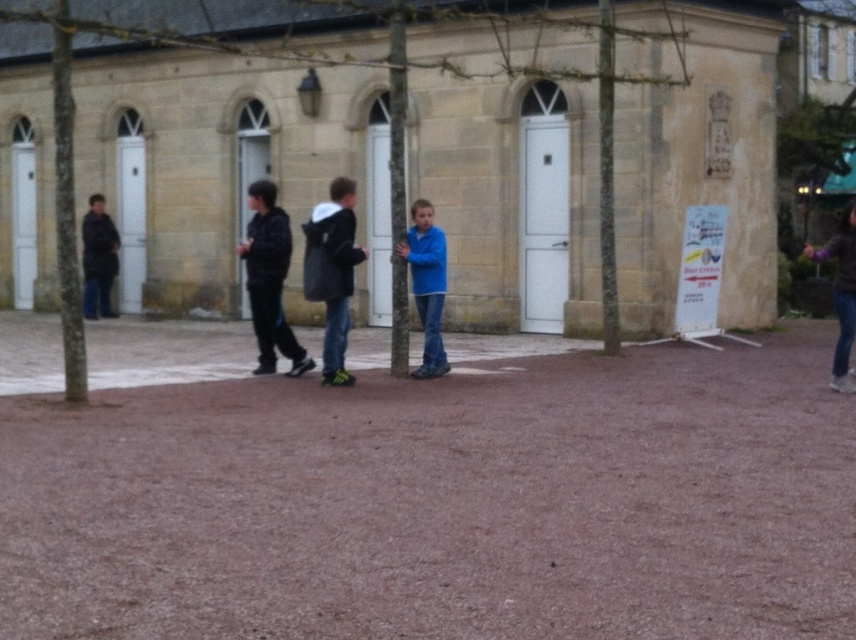
Consider the image. You are a delivery person needing to place a package between the smooth bark tree at center and the dark brown leather jacket at left. The package requires 2 meters of space. Is there enough space between them?

The smooth bark tree at center and dark brown leather jacket at left are 3.60 meters apart, so yes, there is enough space between them to place the package as the distance is greater than 2 meters.

You are standing in the courtyard and want to see the entrance of the stone building. The smooth bark tree at center and the blue matte jacket at center are blocking your view. Which object is closer to you, making it the main obstruction?

The smooth bark tree at center is located above the blue matte jacket at center, so the blue matte jacket at center is closer to you and is the main obstruction.

You are a photographer trying to capture a group photo of the blue matte jacket at center and the smooth bark tree at center. If you want to ensure both are fully visible in the frame, which object requires more space in the camera frame due to its width?

The smooth bark tree at center requires more space in the camera frame because its width is larger than the blue matte jacket at center.